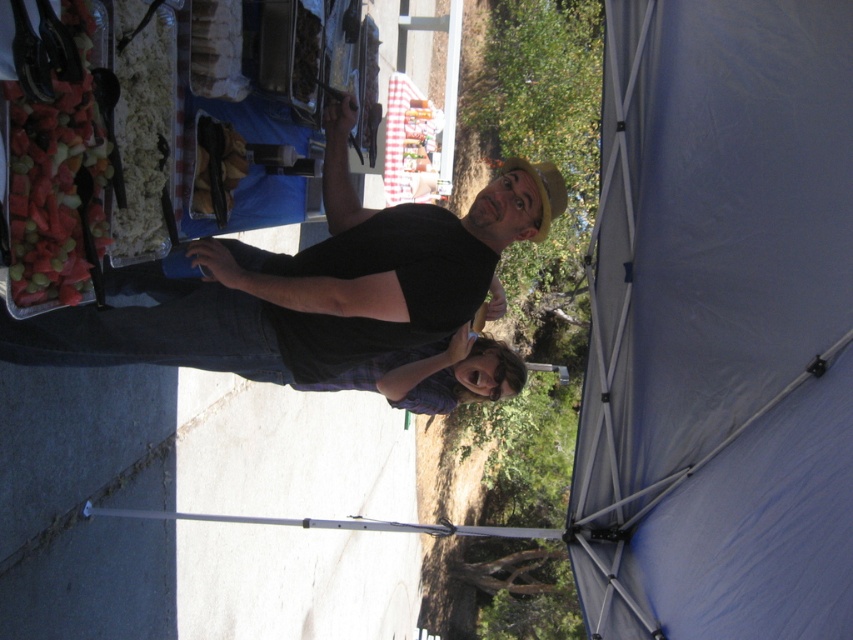
In the scene shown: Does blue fabric tent at upper right appear under black matte shirt at center?

Correct, blue fabric tent at upper right is located below black matte shirt at center.

Who is taller, blue fabric tent at upper right or black matte shirt at center?

blue fabric tent at upper right

Consider the image. Who is more distant from viewer, (817, 536) or (527, 232)?

Point (527, 232)

You are a GUI agent. You are given a task and a screenshot of the screen. Output one action in this format:
    pyautogui.click(x=<x>, y=<y>)
    Task: Click on the blue fabric tent at upper right
    Image resolution: width=853 pixels, height=640 pixels.
    Given the screenshot: What is the action you would take?
    pyautogui.click(x=718, y=326)